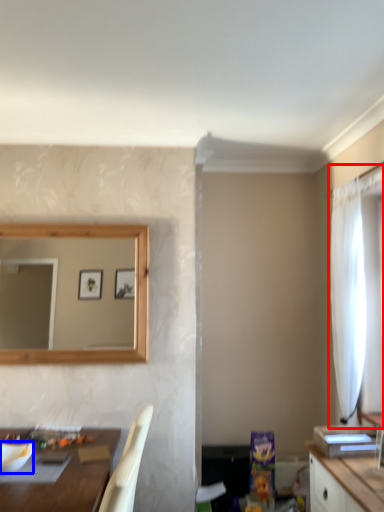
Question: Which of the following is the closest to the observer, curtain (highlighted by a red box) or mixing bowl (highlighted by a blue box)?

Choices:
 (A) curtain
 (B) mixing bowl

Answer: (B)